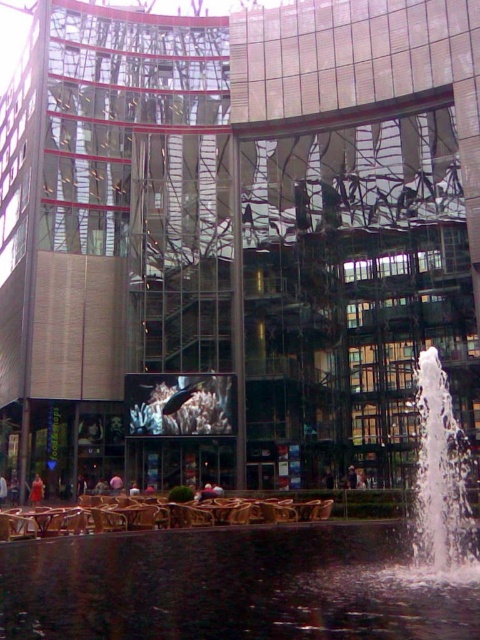
Question: Which object is closer to the camera taking this photo?

Choices:
 (A) white frothy water at lower right
 (B) brown wooden chairs at lower center
 (C) brown wooden table at center

Answer: (A)

Question: Which point appears closest to the camera in this image?

Choices:
 (A) (320, 515)
 (B) (166, 556)
 (C) (445, 564)
 (D) (142, 518)

Answer: (C)

Question: Which object appears closest to the camera in this image?

Choices:
 (A) white frothy water at lower right
 (B) brown wooden chairs at lower center

Answer: (A)

Question: Can you confirm if black reflective water at lower center is wider than white frothy water at lower right?

Choices:
 (A) yes
 (B) no

Answer: (A)

Question: Does black reflective water at lower center have a larger size compared to brown wooden chairs at lower center?

Choices:
 (A) yes
 (B) no

Answer: (A)

Question: Does brown wooden chairs at lower center have a greater width compared to brown wooden table at center?

Choices:
 (A) yes
 (B) no

Answer: (A)